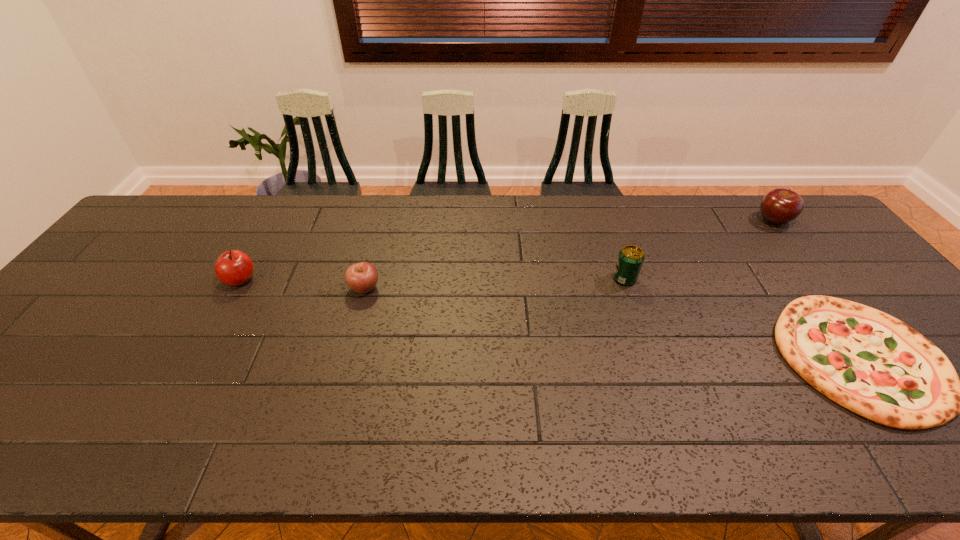
Identify the location of the farthest apple. (779, 206).

In order to click on the rightmost apple in this screenshot , I will do `click(779, 206)`.

The width and height of the screenshot is (960, 540). I want to click on the leftmost apple, so click(x=233, y=267).

What are the coordinates of `the third object from right to left` in the screenshot? It's located at [x=630, y=259].

Locate an element on the screen. The width and height of the screenshot is (960, 540). the fourth tallest object is located at coordinates (362, 277).

At what (x,y) coordinates should I click in order to perform the action: click on the second object from left to right. Please return your answer as a coordinate pair (x, y). This screenshot has width=960, height=540. Looking at the image, I should click on (362, 277).

Identify the location of free space located on the right of the farthest object. The width and height of the screenshot is (960, 540). (806, 220).

What are the coordinates of `free spot located on the left of the leftmost object` in the screenshot? It's located at pos(188,280).

Where is `free space located 0.220m on the right of the beer can`? This screenshot has height=540, width=960. free space located 0.220m on the right of the beer can is located at coordinates (714, 279).

The image size is (960, 540). I want to click on vacant space located 0.340m on the side of the shortest apple with the unique marking, so click(503, 288).